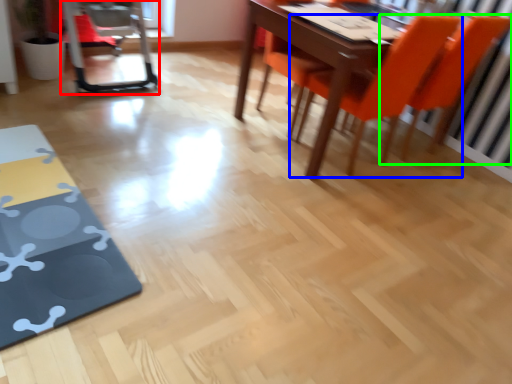
Question: Estimate the real-world distances between objects in this image. Which object is closer to swivel chair (highlighted by a red box), chair (highlighted by a blue box) or chair (highlighted by a green box)?

Choices:
 (A) chair
 (B) chair

Answer: (A)